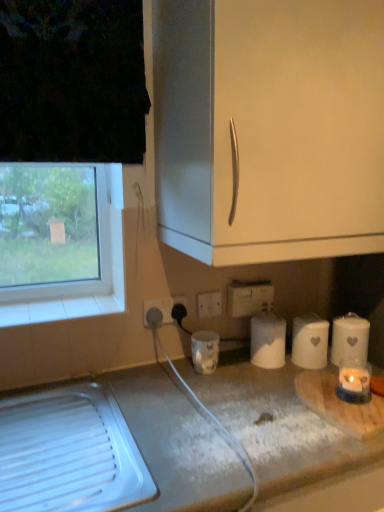
The image size is (384, 512). I want to click on free location to the left of white matte paper towel at center, which is the first paper towel from left to right, so click(x=229, y=370).